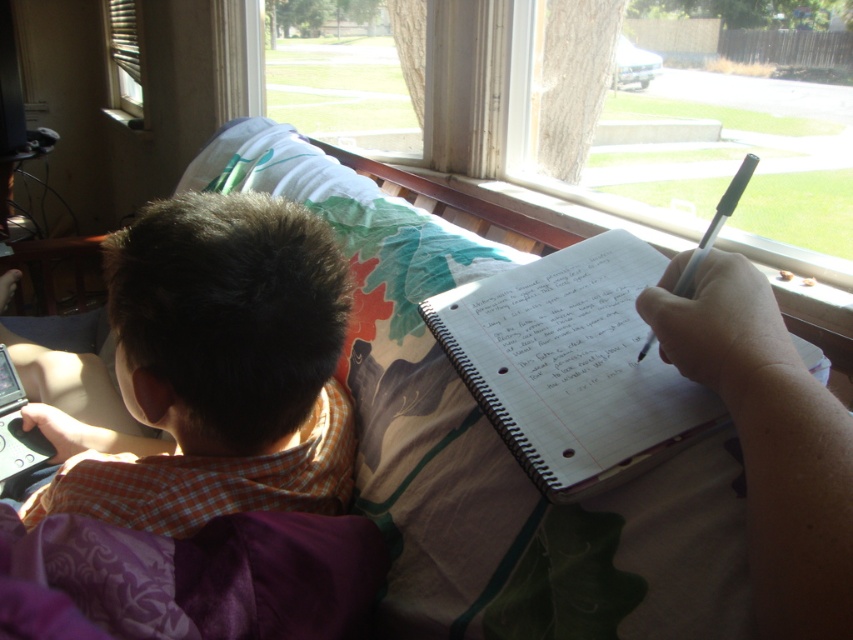
Does white paper at center have a greater height compared to black plastic pen at upper right?

Incorrect, white paper at center's height is not larger of black plastic pen at upper right's.

Which is in front, point (523, 296) or point (694, 252)?

Positioned in front is point (694, 252).

Which is in front, point (618, 324) or point (728, 204)?

Point (728, 204)

Where is `white paper at center`? The width and height of the screenshot is (853, 640). white paper at center is located at coordinates (x=566, y=317).

Does white paper notebook at center appear under black plastic pen at upper right?

Yes, white paper notebook at center is below black plastic pen at upper right.

Does white paper notebook at center come behind black plastic pen at upper right?

No.

Where is `white paper notebook at center`? The width and height of the screenshot is (853, 640). white paper notebook at center is located at coordinates (572, 365).

Identify the location of white paper notebook at center. (572, 365).

Does point (160, 413) lie behind point (128, 83)?

No, (160, 413) is closer to viewer.

Does brown checkered shirt at left appear on the right side of wooden blinds at upper left?

Yes, brown checkered shirt at left is to the right of wooden blinds at upper left.

At what (x,y) coordinates should I click in order to perform the action: click on brown checkered shirt at left. Please return your answer as a coordinate pair (x, y). This screenshot has width=853, height=640. Looking at the image, I should click on (215, 371).